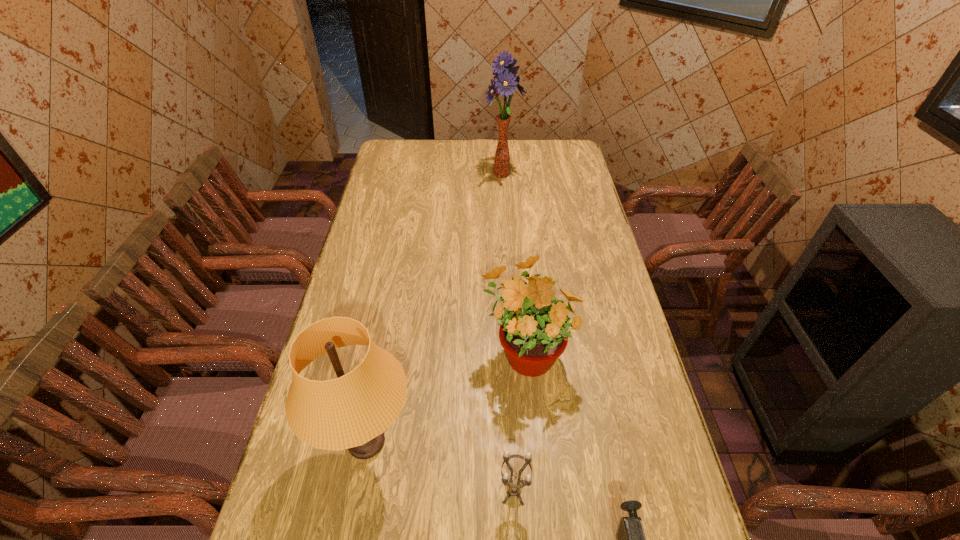
Where is `object present at the far edge`? object present at the far edge is located at coordinates (506, 81).

You are a GUI agent. You are given a task and a screenshot of the screen. Output one action in this format:
    pyautogui.click(x=<x>, y=<y>)
    Task: Click on the object at the left edge
    The image size is (960, 540).
    Given the screenshot: What is the action you would take?
    click(351, 412)

In the image, there is a desktop. At what (x,y) coordinates should I click in order to perform the action: click on vacant space at the far edge. Please return your answer as a coordinate pair (x, y). This screenshot has width=960, height=540. Looking at the image, I should click on pyautogui.click(x=420, y=164).

Where is `free space at the left edge of the desktop`? This screenshot has height=540, width=960. free space at the left edge of the desktop is located at coordinates (386, 167).

In the image, there is a desktop. Identify the location of vacant space at the right edge. This screenshot has height=540, width=960. (587, 212).

Locate an element on the screen. This screenshot has width=960, height=540. free space at the far right corner of the desktop is located at coordinates (551, 140).

This screenshot has width=960, height=540. I want to click on empty location between the flower arrangement and the third shortest object, so click(x=514, y=262).

Where is `free space that is in between the lampshade and the third shortest object`? free space that is in between the lampshade and the third shortest object is located at coordinates (446, 396).

Locate an element on the screen. The image size is (960, 540). vacant area that lies between the third tallest object and the leftmost object is located at coordinates 446,396.

This screenshot has height=540, width=960. Find the location of `vacant area between the farthest object and the fourth nearest object`. vacant area between the farthest object and the fourth nearest object is located at coordinates (514, 262).